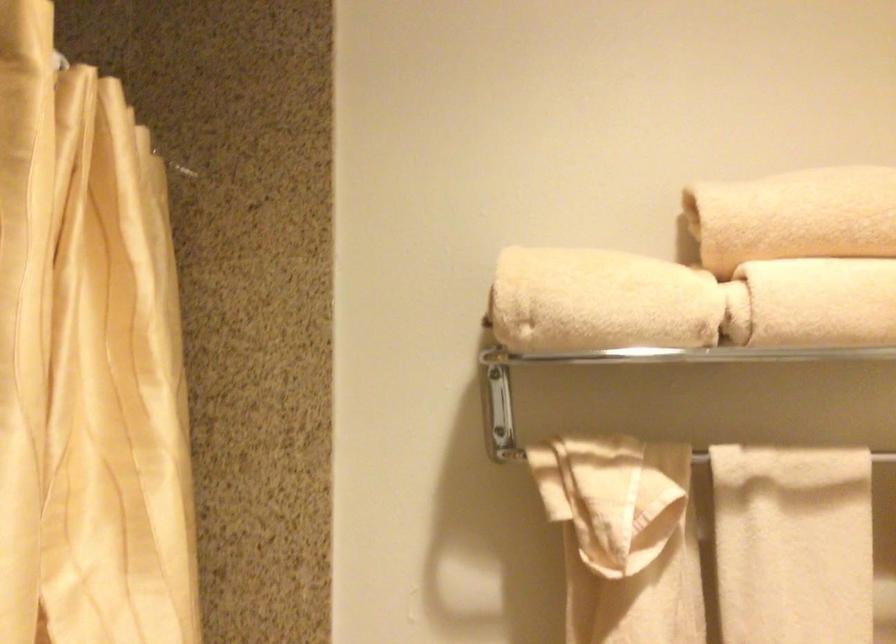
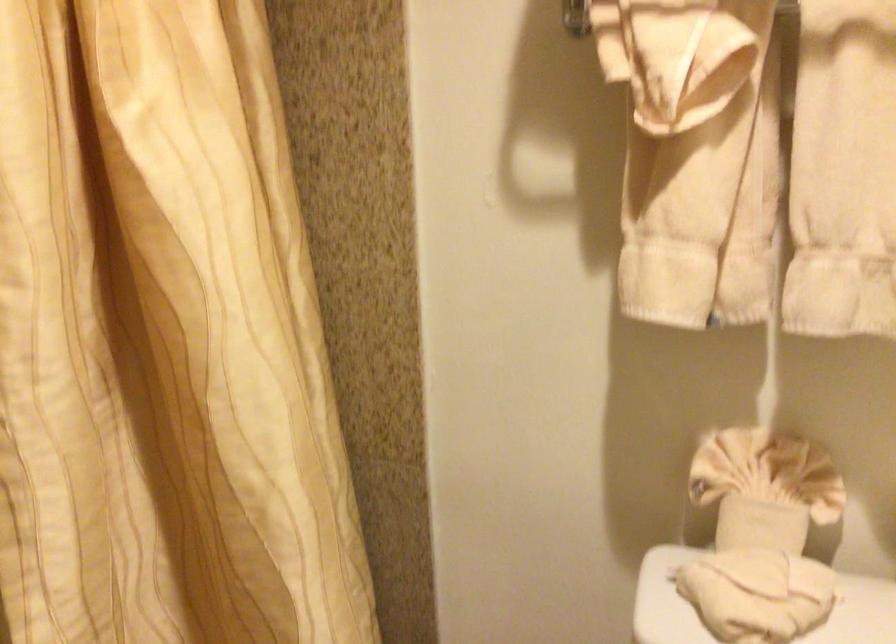
The first image is from the beginning of the video and the second image is from the end. How did the camera likely rotate when shooting the video?

The rotation direction of the camera is left-down.